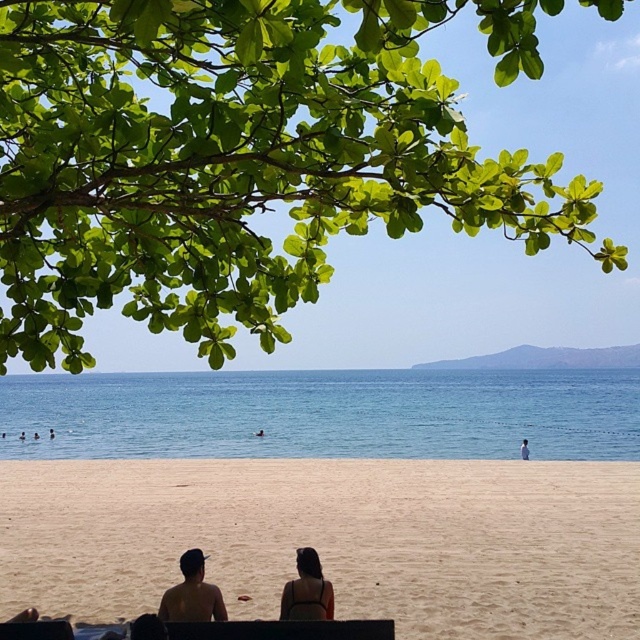
You are standing on the beach and see the green leafy branch at upper left and the sandy beige at lower center. Which object is closer to you?

The green leafy branch at upper left is closer to you because it is in front of the sandy beige at lower center.